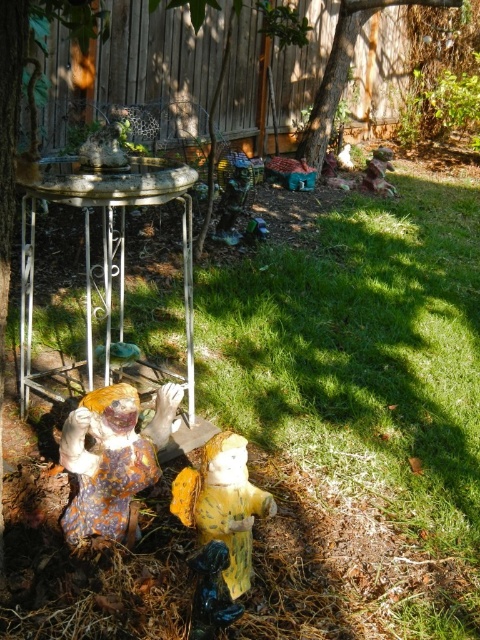
Question: Can you confirm if metallic silver table at center-left is positioned to the right of speckled ceramic figurine at lower left?

Choices:
 (A) yes
 (B) no

Answer: (B)

Question: Which point is farther from the camera taking this photo?

Choices:
 (A) (98, 422)
 (B) (171, 374)

Answer: (B)

Question: Which point appears farthest from the camera in this image?

Choices:
 (A) (81, 410)
 (B) (156, 198)

Answer: (B)

Question: Is metallic silver table at center-left above speckled ceramic figurine at lower left?

Choices:
 (A) no
 (B) yes

Answer: (B)

Question: From the image, what is the correct spatial relationship of metallic silver table at center-left in relation to speckled ceramic figurine at lower left?

Choices:
 (A) right
 (B) left

Answer: (B)

Question: Among these points, which one is farthest from the camera?

Choices:
 (A) 51,170
 (B) 106,397

Answer: (A)